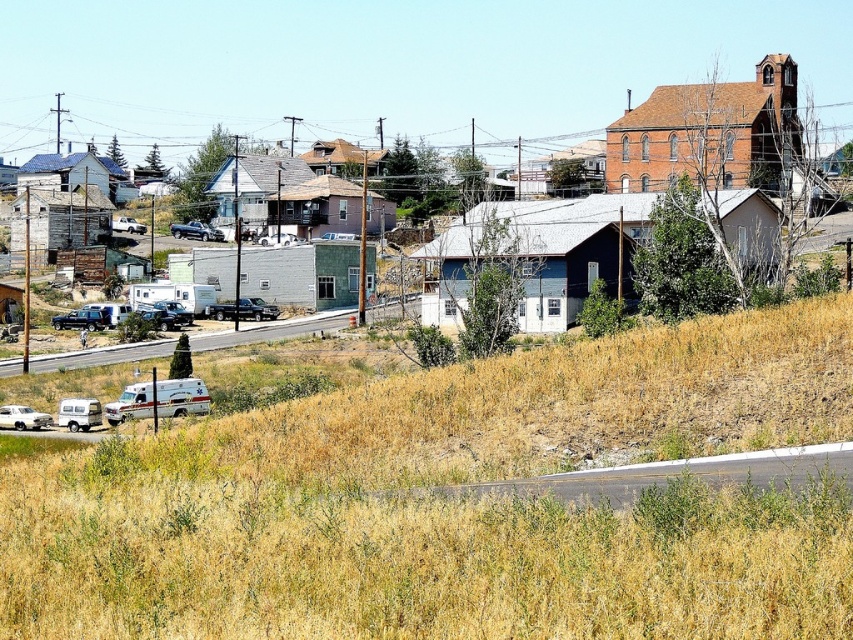
Question: Can you confirm if dry grass at lower center is positioned above matte gray building at center?

Choices:
 (A) no
 (B) yes

Answer: (A)

Question: Is dry grass at lower center above matte gray building at center?

Choices:
 (A) no
 (B) yes

Answer: (A)

Question: Which point is farther from the camera taking this photo?

Choices:
 (A) (643, 124)
 (B) (218, 573)

Answer: (A)

Question: Which point is farther from the camera taking this photo?

Choices:
 (A) (345, 426)
 (B) (518, 188)

Answer: (B)

Question: Which of the following is the farthest from the observer?

Choices:
 (A) dry grass at lower center
 (B) matte gray building at center

Answer: (B)

Question: Is dry grass at lower center above matte gray building at center?

Choices:
 (A) yes
 (B) no

Answer: (B)